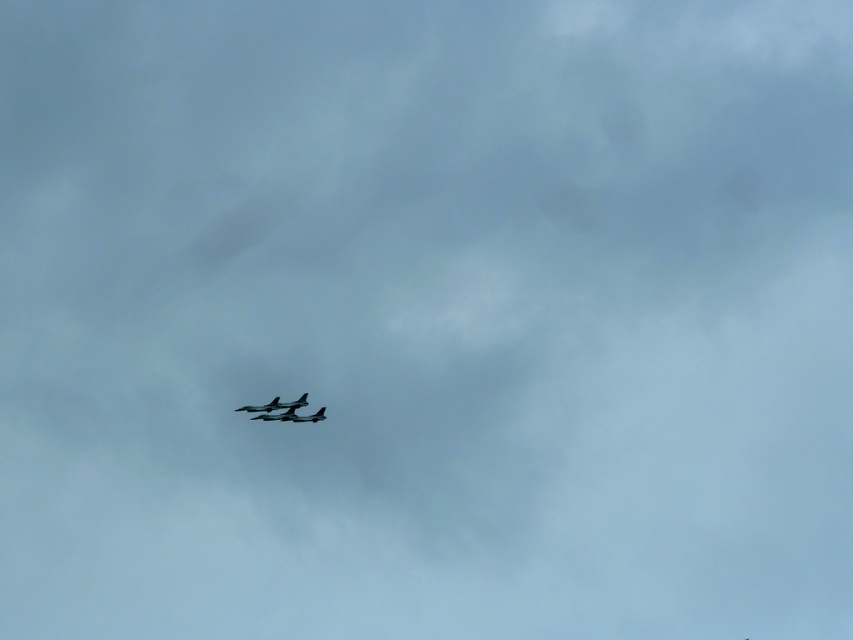
You are a pilot observing the formation of three aircraft in the sky. You notice two specific planes in the formation, the shiny dark gray jet at center and the shiny silver airplane at center. Which of these two planes is closer to you?

The shiny dark gray jet at center is closer to you because it is positioned further to the viewer than the shiny silver airplane at center.

Based on the photo, you are a pilot observing the formation of the shiny dark gray jet at center and the shiny silver airplane at center. Which aircraft is positioned lower in the sky?

The shiny dark gray jet at center is positioned below the shiny silver airplane at center, so it is lower in the sky.

You are a pilot observing three military jets flying in formation in the cloudy sky. You notice a specific point labeled as point (x=292, y=416). Which jet is this point located on?

The point (x=292, y=416) is located on the shiny dark gray jet at center.